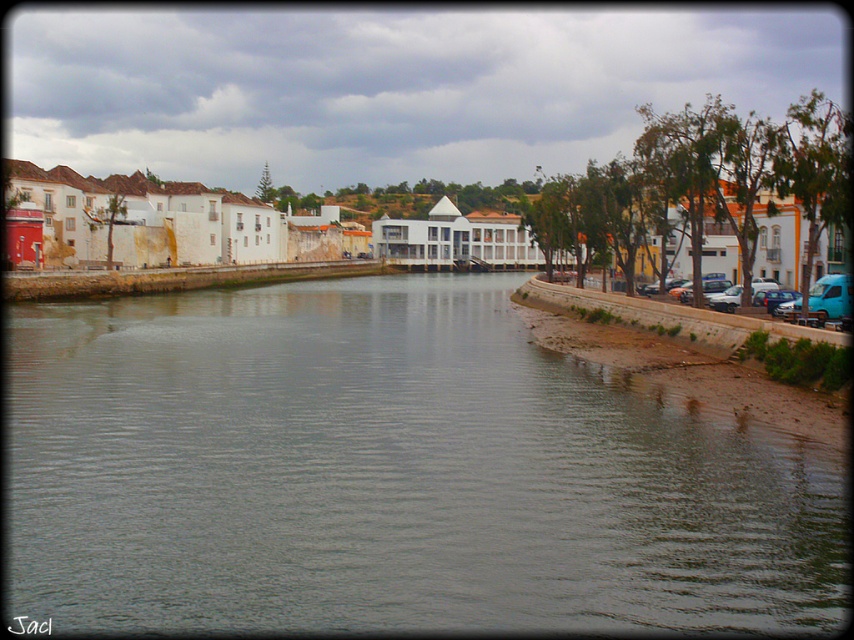
You are a tourist standing on the riverside path and want to cross to the other side. The green water at center and brown stone embankment at right are in your path. Which one is wider, making it easier to navigate around?

The green water at center is wider than the brown stone embankment at right, so it would be easier to navigate around the narrower brown stone embankment at right.

You are standing at the edge of the river in the riverside scene. You want to know the exact 2D coordinates of the green water at center. What are they?

The green water at center is located at the 2D coordinates of point (x=390, y=474).